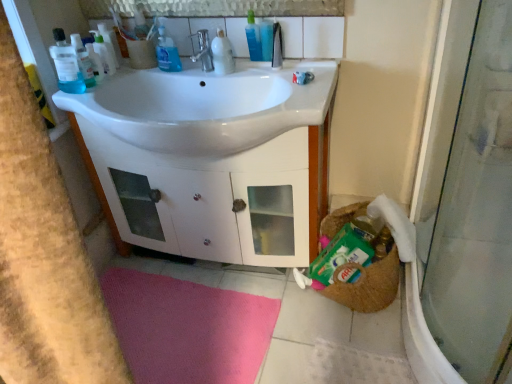
At what (x,y) coordinates should I click in order to perform the action: click on white glossy bottle at upper center, placed as the 1th cleaning product when sorted from right to left. Please return your answer as a coordinate pair (x, y). This screenshot has height=384, width=512. Looking at the image, I should click on (222, 54).

This screenshot has height=384, width=512. What do you see at coordinates (205, 106) in the screenshot?
I see `white glossy sink at center` at bounding box center [205, 106].

I want to click on white glossy sink at center, so click(205, 106).

I want to click on blue liquid soap at upper center, which is the 2th cleaning product from right to left, so click(x=167, y=50).

How many degrees apart are the facing directions of white glossy bottle at upper center, acting as the 2th cleaning product starting from the left, and blue liquid soap at upper center, which is the 2th cleaning product from right to left?

The angular difference between white glossy bottle at upper center, acting as the 2th cleaning product starting from the left, and blue liquid soap at upper center, which is the 2th cleaning product from right to left, is 2.05 degrees.

From the picture: Considering their positions, is white glossy bottle at upper center, placed as the 1th cleaning product when sorted from right to left, located in front of or behind blue liquid soap at upper center, which is the 1th cleaning product from left to right?

Visually, white glossy bottle at upper center, placed as the 1th cleaning product when sorted from right to left, is located in front of blue liquid soap at upper center, which is the 1th cleaning product from left to right.

From the image's perspective, which one is positioned higher, white glossy bottle at upper center, placed as the 1th cleaning product when sorted from right to left, or blue liquid soap at upper center, which is the 2th cleaning product from right to left?

blue liquid soap at upper center, which is the 2th cleaning product from right to left.

Would you say white glossy bottle at upper center, placed as the 1th cleaning product when sorted from right to left, contains blue liquid soap at upper center, which is the 2th cleaning product from right to left?

No.

Does point (220, 70) come farther from viewer compared to point (106, 167)?

No, it is not.

Considering the sizes of white glossy bottle at upper center, acting as the 2th cleaning product starting from the left, and white glossy cabinet at center in the image, is white glossy bottle at upper center, acting as the 2th cleaning product starting from the left, taller or shorter than white glossy cabinet at center?

In the image, white glossy bottle at upper center, acting as the 2th cleaning product starting from the left, appears to be shorter than white glossy cabinet at center.

From a real-world perspective, is white glossy bottle at upper center, placed as the 1th cleaning product when sorted from right to left, beneath white glossy cabinet at center?

No, from a real-world perspective, white glossy bottle at upper center, placed as the 1th cleaning product when sorted from right to left, is not beneath white glossy cabinet at center.

Is white glossy cabinet at center positioned with its back to white glossy sink at center?

That's not correct — white glossy cabinet at center is not looking away from white glossy sink at center.

Is point (325, 180) positioned after point (192, 80)?

Yes, it is.

How far apart are white glossy cabinet at center and white glossy sink at center?

white glossy cabinet at center and white glossy sink at center are 11.10 inches apart from each other.

Considering the relative sizes of white glossy cabinet at center and white glossy sink at center in the image provided, is white glossy cabinet at center shorter than white glossy sink at center?

No.

How much distance is there between translucent plastic bottle at upper center and satin nickel faucet at center?

translucent plastic bottle at upper center and satin nickel faucet at center are 7.39 inches apart.

Is translucent plastic bottle at upper center inside the boundaries of satin nickel faucet at center, or outside?

translucent plastic bottle at upper center cannot be found inside satin nickel faucet at center.

Does point (260, 49) come behind point (189, 36)?

No, (260, 49) is in front of (189, 36).

Based on the photo, how different are the orientations of translucent plastic bottle at upper center and satin nickel faucet at center in degrees?

The angular difference between translucent plastic bottle at upper center and satin nickel faucet at center is 2.59 degrees.

Consider the image. From a real-world perspective, which object rests below the other?

From a 3D spatial view, white glossy sink at center is below.

Where is `tap on the right of white glossy sink at center`? Image resolution: width=512 pixels, height=384 pixels. tap on the right of white glossy sink at center is located at coordinates (203, 50).

Which object is further away from the camera taking this photo, white glossy sink at center or satin nickel faucet at center?

Positioned behind is satin nickel faucet at center.

Are white glossy sink at center and satin nickel faucet at center making contact?

white glossy sink at center and satin nickel faucet at center are not in contact.

From the image's perspective, which one is positioned higher, satin nickel faucet at center or white glossy cabinet at center?

satin nickel faucet at center, from the image's perspective.

Which object is closer to the camera taking this photo, satin nickel faucet at center or white glossy cabinet at center?

white glossy cabinet at center is in front.

At what (x,y) coordinates should I click in order to perform the action: click on bathroom cabinet located on the left of satin nickel faucet at center. Please return your answer as a coordinate pair (x, y). The width and height of the screenshot is (512, 384). Looking at the image, I should click on (217, 198).

From the image's perspective, is white glossy cabinet at center under satin nickel faucet at center?

Indeed, from the image's perspective, white glossy cabinet at center is shown beneath satin nickel faucet at center.

The width and height of the screenshot is (512, 384). In order to click on tap above the white glossy cabinet at center (from the image's perspective) in this screenshot , I will do `click(203, 50)`.

Where is `cleaning product below the blue liquid soap at upper center, which is the 2th cleaning product from right to left (from the image's perspective)`? The image size is (512, 384). cleaning product below the blue liquid soap at upper center, which is the 2th cleaning product from right to left (from the image's perspective) is located at coordinates (222, 54).

This screenshot has height=384, width=512. I want to click on bathroom cabinet in front of the white glossy bottle at upper center, placed as the 1th cleaning product when sorted from right to left, so click(217, 198).

When comparing their distances from white glossy bottle at upper center, acting as the 2th cleaning product starting from the left, does white glossy sink at center or satin nickel faucet at center seem further?

white glossy sink at center lies further to white glossy bottle at upper center, acting as the 2th cleaning product starting from the left, than the other object.

Which object lies further to the anchor point translucent plastic bottle at upper center, white glossy cabinet at center or white glossy bottle at upper center, placed as the 1th cleaning product when sorted from right to left?

Among the two, white glossy cabinet at center is located further to translucent plastic bottle at upper center.

When comparing their distances from blue liquid soap at upper center, which is the 1th cleaning product from left to right, does white glossy cabinet at center or white glossy sink at center seem closer?

Based on the image, white glossy sink at center appears to be nearer to blue liquid soap at upper center, which is the 1th cleaning product from left to right.

Looking at the image, which one is located further to blue liquid soap at upper center, which is the 1th cleaning product from left to right, white glossy bottle at upper center, placed as the 1th cleaning product when sorted from right to left, or white glossy sink at center?

white glossy sink at center lies further to blue liquid soap at upper center, which is the 1th cleaning product from left to right, than the other object.

Estimate the real-world distances between objects in this image. Which object is closer to white glossy cabinet at center, white glossy sink at center or satin nickel faucet at center?

white glossy sink at center is closer to white glossy cabinet at center.

From the image, which object appears to be nearer to blue liquid soap at upper center, which is the 2th cleaning product from right to left, white glossy sink at center or white glossy bottle at upper center, acting as the 2th cleaning product starting from the left?

white glossy bottle at upper center, acting as the 2th cleaning product starting from the left.

From the image, which object appears to be nearer to white glossy bottle at upper center, acting as the 2th cleaning product starting from the left, satin nickel faucet at center or blue liquid soap at upper center, which is the 2th cleaning product from right to left?

Among the two, satin nickel faucet at center is located nearer to white glossy bottle at upper center, acting as the 2th cleaning product starting from the left.

Estimate the real-world distances between objects in this image. Which object is further from translucent plastic bottle at upper center, white glossy bottle at upper center, acting as the 2th cleaning product starting from the left, or blue liquid soap at upper center, which is the 1th cleaning product from left to right?

Among the two, blue liquid soap at upper center, which is the 1th cleaning product from left to right, is located further to translucent plastic bottle at upper center.

This screenshot has width=512, height=384. What are the coordinates of `tap between blue liquid soap at upper center, which is the 1th cleaning product from left to right, and translucent plastic bottle at upper center, in the horizontal direction` in the screenshot? It's located at (203, 50).

At what (x,y) coordinates should I click in order to perform the action: click on tap between white glossy sink at center and translucent plastic bottle at upper center along the z-axis. Please return your answer as a coordinate pair (x, y). This screenshot has width=512, height=384. Looking at the image, I should click on (203, 50).

Where is `sink between satin nickel faucet at center and white glossy cabinet at center vertically`? sink between satin nickel faucet at center and white glossy cabinet at center vertically is located at coordinates (205, 106).

This screenshot has width=512, height=384. I want to click on sink between translucent plastic bottle at upper center and white glossy cabinet at center in the vertical direction, so click(205, 106).